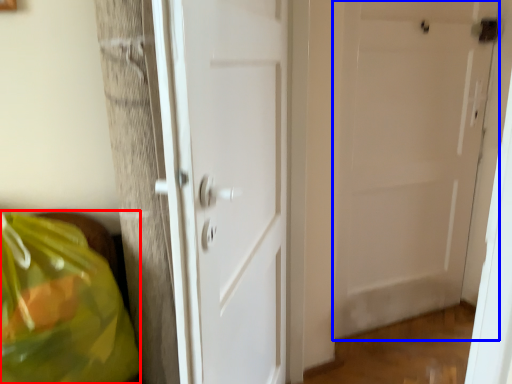
Question: Which point is further to the camera, grocery bag (highlighted by a red box) or door (highlighted by a blue box)?

Choices:
 (A) grocery bag
 (B) door

Answer: (B)